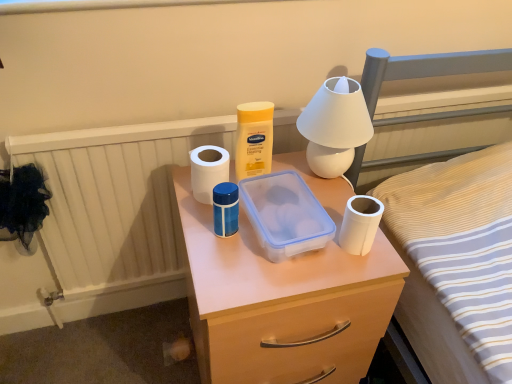
Question: From a real-world perspective, relative to yellow plastic container at center, is translucent plastic container at center vertically above or below?

Choices:
 (A) below
 (B) above

Answer: (A)

Question: Considering the positions of point (x=400, y=281) and point (x=246, y=160), is point (x=400, y=281) closer or farther from the camera than point (x=246, y=160)?

Choices:
 (A) farther
 (B) closer

Answer: (B)

Question: Estimate the real-world distances between objects in this image. Which object is closer to the transparent plastic container at center?

Choices:
 (A) white matte toilet paper at center, arranged as the 1th toilet paper when viewed from the back
 (B) translucent plastic container at center
 (C) yellow plastic container at center
 (D) white matte toilet paper at right, the 1th toilet paper in the front-to-back sequence
 (E) white matte table lamp at upper center

Answer: (D)

Question: Based on their relative distances, which object is nearer to the transparent plastic container at center?

Choices:
 (A) white matte table lamp at upper center
 (B) white matte toilet paper at right, which is the 1th toilet paper from right to left
 (C) yellow plastic container at center
 (D) white matte toilet paper at center, arranged as the 1th toilet paper when viewed from the back
 (E) translucent plastic container at center

Answer: (B)